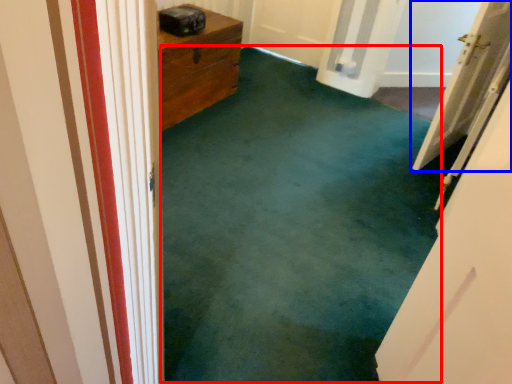
Question: Which point is closer to the camera, corridor (highlighted by a red box) or door (highlighted by a blue box)?

Choices:
 (A) corridor
 (B) door

Answer: (A)